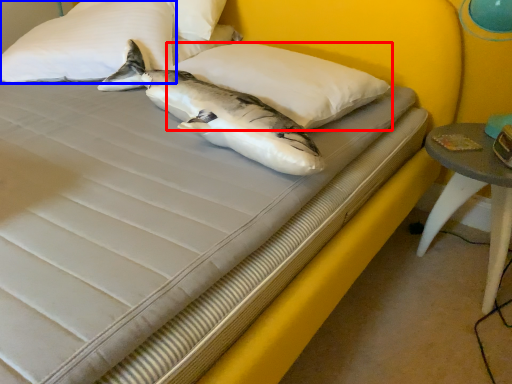
Question: Which object is further to the camera taking this photo, pillow (highlighted by a red box) or pillow (highlighted by a blue box)?

Choices:
 (A) pillow
 (B) pillow

Answer: (B)